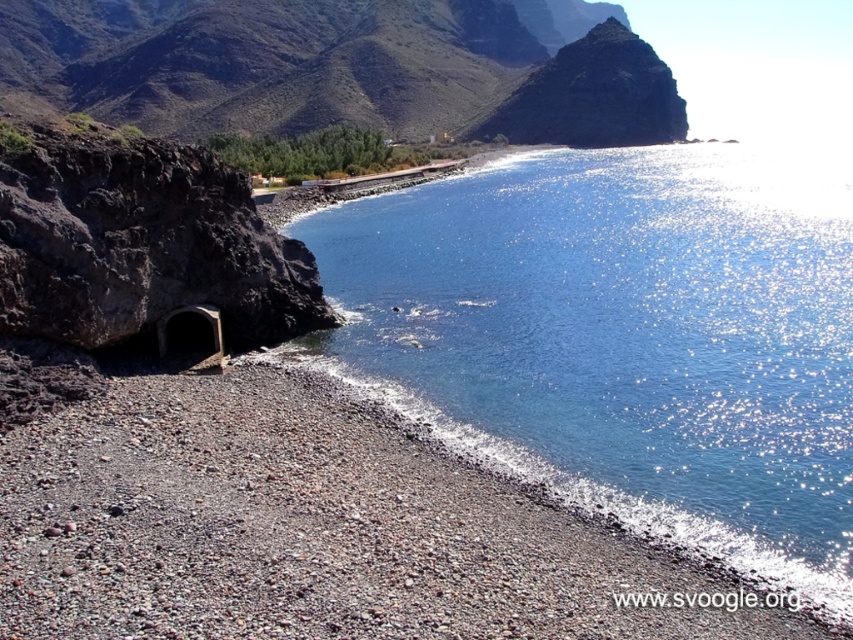
Does blue glassy water at center have a larger size compared to rugged rock mountain at upper left?

Actually, blue glassy water at center might be smaller than rugged rock mountain at upper left.

Does blue glassy water at center appear on the left side of rugged rock mountain at upper left?

Incorrect, blue glassy water at center is not on the left side of rugged rock mountain at upper left.

Who is more forward, (798, 260) or (550, 77)?

Point (798, 260) is in front.

At what (x,y) coordinates should I click in order to perform the action: click on blue glassy water at center. Please return your answer as a coordinate pair (x, y). The height and width of the screenshot is (640, 853). Looking at the image, I should click on (624, 337).

Is point (114, 424) farther from viewer compared to point (405, 115)?

No.

Does smooth pebbles at lower left have a greater width compared to rugged rock mountain at upper left?

No, smooth pebbles at lower left is not wider than rugged rock mountain at upper left.

At what (x,y) coordinates should I click in order to perform the action: click on smooth pebbles at lower left. Please return your answer as a coordinate pair (x, y). The width and height of the screenshot is (853, 640). Looking at the image, I should click on (316, 529).

At what (x,y) coordinates should I click in order to perform the action: click on smooth pebbles at lower left. Please return your answer as a coordinate pair (x, y). This screenshot has height=640, width=853. Looking at the image, I should click on (316, 529).

Which of these two, blue glassy water at center or smooth pebbles at lower left, stands taller?

blue glassy water at center is taller.

Does blue glassy water at center have a lesser width compared to smooth pebbles at lower left?

In fact, blue glassy water at center might be wider than smooth pebbles at lower left.

The height and width of the screenshot is (640, 853). In order to click on blue glassy water at center in this screenshot , I will do `click(624, 337)`.

Find the location of `blue glassy water at center`. blue glassy water at center is located at coordinates (624, 337).